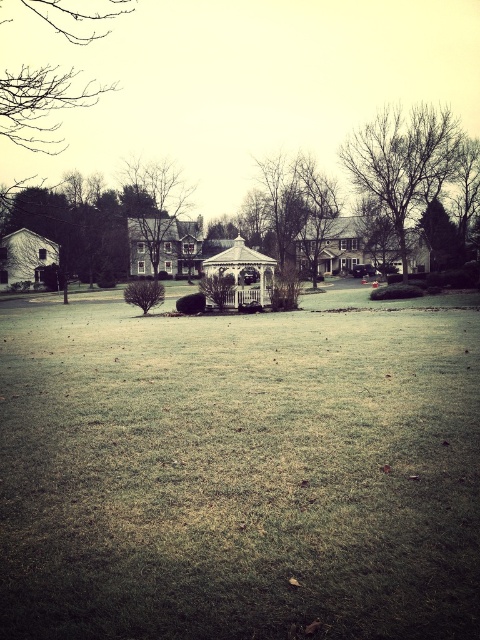
Is green grass at center to the right of white wooden gazebo at center from the viewer's perspective?

No, green grass at center is not to the right of white wooden gazebo at center.

Is green grass at center wider than white wooden gazebo at center?

Yes.

Measure the distance between point (253, 480) and camera.

Point (253, 480) is 17.51 feet from camera.

Identify the location of green grass at center. The height and width of the screenshot is (640, 480). (238, 474).

Is bare branches at upper right further to the viewer compared to brown wood tree at upper center?

No, bare branches at upper right is closer to the viewer.

Can you confirm if bare branches at upper right is smaller than brown wood tree at upper center?

No.

Between point (377, 184) and point (140, 182), which one is positioned in front?

Point (377, 184)

This screenshot has height=640, width=480. In order to click on bare branches at upper right in this screenshot , I will do `click(404, 163)`.

Is bare branches at upper right below white wooden gazebo at center?

No, bare branches at upper right is not below white wooden gazebo at center.

Can you confirm if bare branches at upper right is thinner than white wooden gazebo at center?

No.

Between point (419, 113) and point (237, 296), which one is positioned behind?

Point (419, 113)

This screenshot has width=480, height=640. Identify the location of bare branches at upper right. (404, 163).